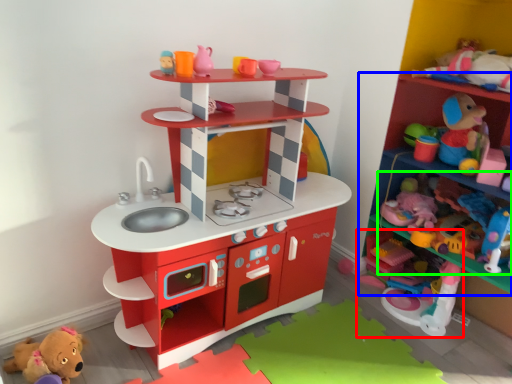
Question: Which object is the farthest from toy (highlighted by a red box)? Choose among these: shelf (highlighted by a blue box) or toy (highlighted by a green box).

Choices:
 (A) shelf
 (B) toy

Answer: (A)